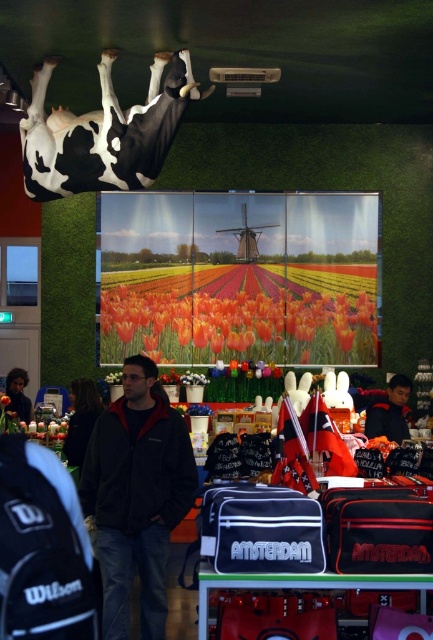
You are a customer browsing in the souvenir shop. You notice the black and white cow at upper center and the dark blue jacket at center. Which object is positioned higher in the shop?

The black and white cow at upper center is positioned higher than the dark blue jacket at center.

You are a customer in the souvenir shop holding a 2.5 meter long ladder. You need to retrieve a souvenir from the top shelf which is located between the dark gray fleece jacket at center and the dark blue jacket at center. Can you safely extend the ladder between them without it touching either jacket?

The distance between the dark gray fleece jacket at center and the dark blue jacket at center is 3.02 meters. Since the ladder is 2.5 meters long, it can be safely extended between them without touching either jacket as the space is wider than the ladder.

You are a customer in the souvenir shop and want to pick up the dark gray fleece jacket at center. However, you notice a hanging black and white cow at upper center above your head. Is there enough space between you and the cow to safely reach for the jacket without hitting your head?

The dark gray fleece jacket at center and the black and white cow at upper center are 9.65 feet apart from each other, which means there is sufficient vertical space for a person to safely reach for the jacket without hitting their head.